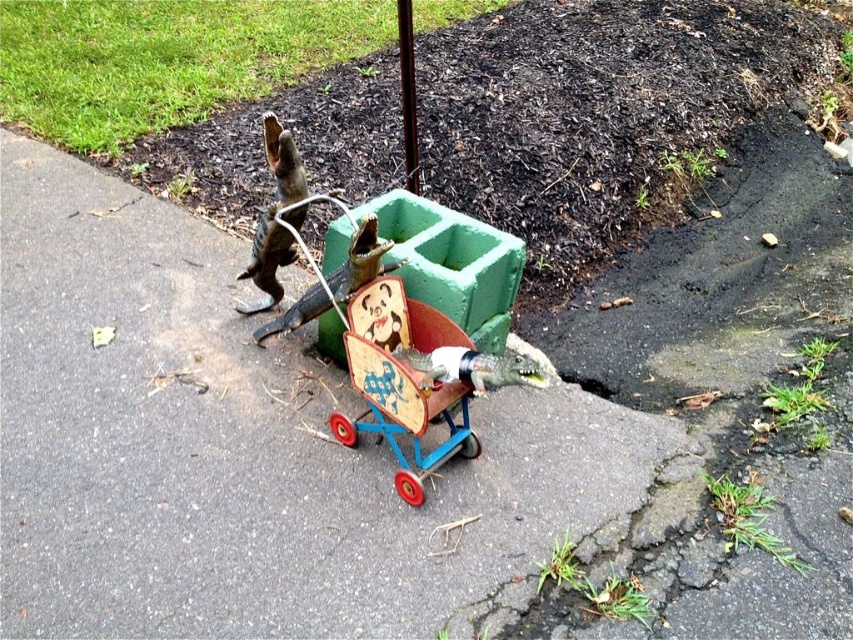
From the picture: You are a child trying to push the wooden toy cart at center along the smooth asphalt pavement at center. The cart is 12 inches wide. Can you push it straight without hitting the edges of the pavement?

The distance between the smooth asphalt pavement at center and wooden toy cart at center is 18.88 inches. Since the cart is 12 inches wide, there is enough space on both sides of the cart to push it straight without hitting the edges of the pavement.

You are a child trying to push the wooden toy cart at center along the smooth asphalt pavement at center. Which direction should you push the cart to stay on the pavement?

The smooth asphalt pavement at center is positioned on the left side of wooden toy cart at center. To stay on the pavement, you should push the cart to the left side.

You are a child trying to place a wooden block on the smooth asphalt pavement at center and the wooden toy cart at center. Which surface will the block stay on better?

The smooth asphalt pavement at center is taller than wooden toy cart at center, so the wooden block will stay on the smooth asphalt pavement at center better because it is higher than the wooden toy cart at center.